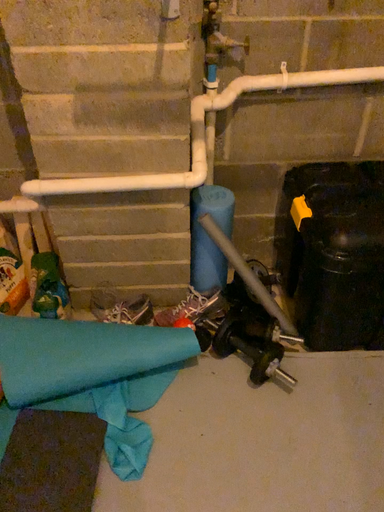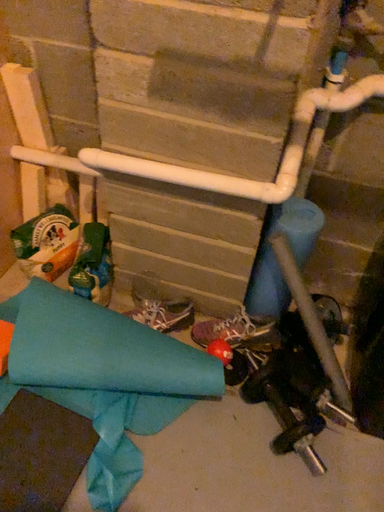
Question: How did the camera likely rotate when shooting the video?

Choices:
 (A) rotated right
 (B) rotated left

Answer: (B)